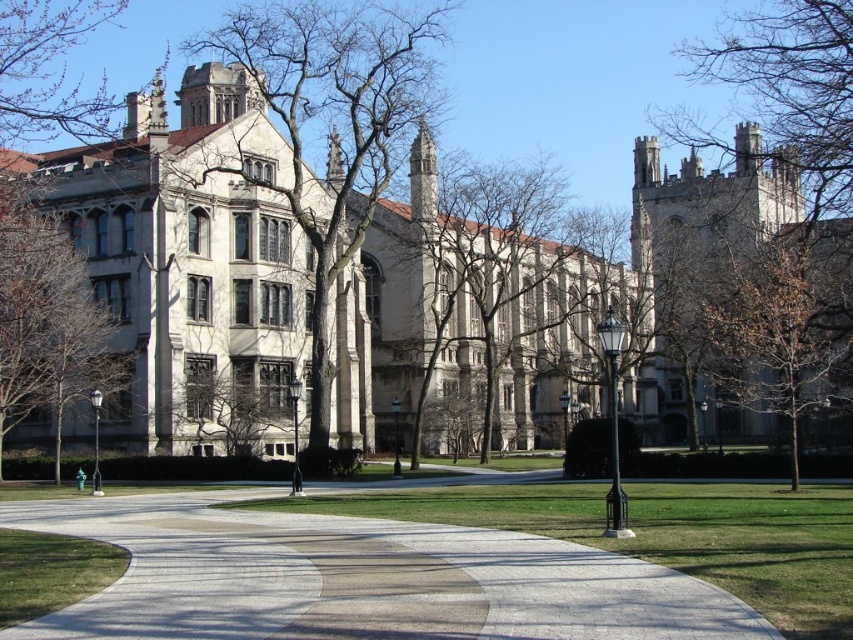
Who is positioned more to the right, bare branches at left or green leafy tree at left?

From the viewer's perspective, bare branches at left appears more on the right side.

Is bare branches at left to the left of green leafy tree at left from the viewer's perspective?

Incorrect, bare branches at left is not on the left side of green leafy tree at left.

Is point (308, 140) behind point (79, 362)?

Yes, point (308, 140) is behind point (79, 362).

The height and width of the screenshot is (640, 853). Find the location of `bare branches at left`. bare branches at left is located at coordinates (331, 124).

Does brown textured tree at center have a lesser width compared to brown leafless tree at right?

No, brown textured tree at center is not thinner than brown leafless tree at right.

Can you confirm if brown textured tree at center is positioned to the left of brown leafless tree at right?

Yes, brown textured tree at center is to the left of brown leafless tree at right.

The image size is (853, 640). Identify the location of brown textured tree at center. (492, 307).

Does brown leafless tree at right lie behind green leafy tree at left?

No, brown leafless tree at right is in front of green leafy tree at left.

Between brown leafless tree at right and green leafy tree at left, which one has less height?

Standing shorter between the two is brown leafless tree at right.

Is point (782, 260) positioned after point (49, 250)?

Yes, point (782, 260) is behind point (49, 250).

Where is `brown leafless tree at right`? Image resolution: width=853 pixels, height=640 pixels. brown leafless tree at right is located at coordinates (782, 324).